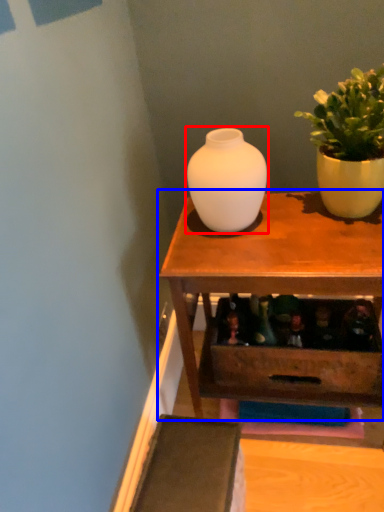
Question: Among these objects, which one is farthest to the camera, vase (highlighted by a red box) or table (highlighted by a blue box)?

Choices:
 (A) vase
 (B) table

Answer: (A)